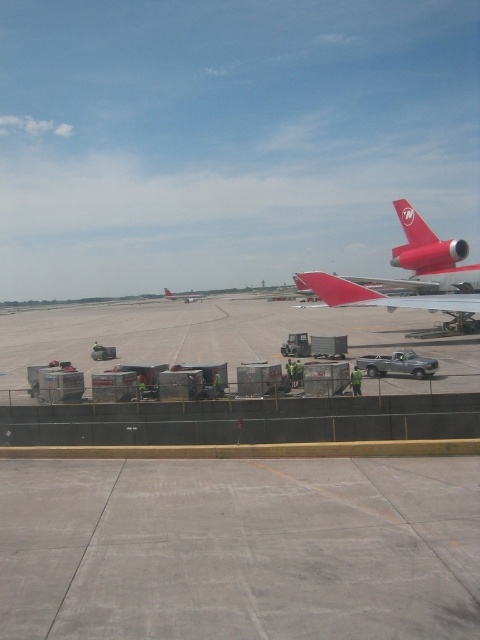
Question: Does matte red airplane at upper right have a lesser width compared to red matte airplane at center?

Choices:
 (A) yes
 (B) no

Answer: (B)

Question: Can you confirm if red matte airplane at center is positioned to the left of metallic silver airplane at center?

Choices:
 (A) yes
 (B) no

Answer: (B)

Question: Which point appears farthest from the camera in this image?

Choices:
 (A) (391, 304)
 (B) (196, 294)
 (C) (456, 280)

Answer: (B)

Question: Does matte red airplane at upper right come behind metallic silver airplane at center?

Choices:
 (A) yes
 (B) no

Answer: (B)

Question: Which object is farther from the camera taking this photo?

Choices:
 (A) matte red airplane at upper right
 (B) metallic silver airplane at center
 (C) red matte airplane at center

Answer: (B)

Question: Among these points, which one is farthest from the camera?

Choices:
 (A) (193, 298)
 (B) (334, 273)
 (C) (425, 294)

Answer: (A)